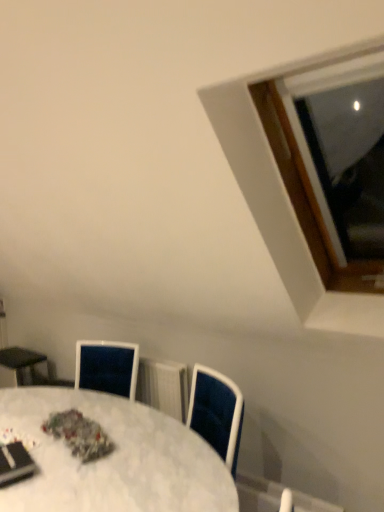
This screenshot has height=512, width=384. What are the coordinates of `empty space that is ontop of white marble table at center (from a real-world perspective)` in the screenshot? It's located at (60, 438).